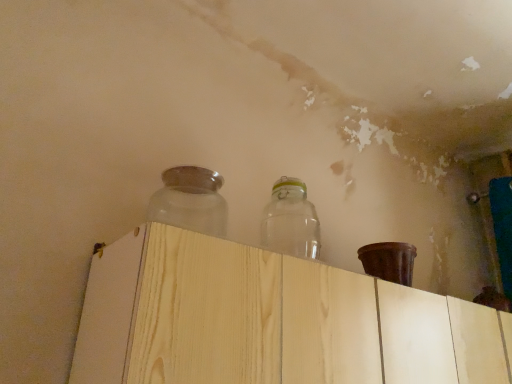
Question: Can you confirm if light wood dresser at center is thinner than frosted glass jar at upper center, the 1th bottle viewed from the left?

Choices:
 (A) yes
 (B) no

Answer: (B)

Question: Is light wood dresser at center to the left of frosted glass jar at upper center, the 1th bottle viewed from the left, from the viewer's perspective?

Choices:
 (A) no
 (B) yes

Answer: (A)

Question: Is frosted glass jar at upper center, the 1th bottle viewed from the left, surrounded by light wood dresser at center?

Choices:
 (A) yes
 (B) no

Answer: (B)

Question: Could you tell me if light wood dresser at center is facing frosted glass jar at upper center, positioned as the second bottle in right-to-left order?

Choices:
 (A) yes
 (B) no

Answer: (B)

Question: Is light wood dresser at center at the right side of frosted glass jar at upper center, the 1th bottle viewed from the left?

Choices:
 (A) no
 (B) yes

Answer: (B)

Question: From the image's perspective, is light wood dresser at center above or below frosted glass jar at upper center, the 1th bottle viewed from the left?

Choices:
 (A) below
 (B) above

Answer: (A)

Question: In the image, is light wood dresser at center on the left side or the right side of frosted glass jar at upper center, positioned as the second bottle in right-to-left order?

Choices:
 (A) right
 (B) left

Answer: (A)

Question: Based on their sizes in the image, would you say light wood dresser at center is bigger or smaller than frosted glass jar at upper center, positioned as the second bottle in right-to-left order?

Choices:
 (A) small
 (B) big

Answer: (B)

Question: In terms of height, does light wood dresser at center look taller or shorter compared to frosted glass jar at upper center, the 1th bottle viewed from the left?

Choices:
 (A) tall
 (B) short

Answer: (A)

Question: Considering their positions, is light wood dresser at center located in front of or behind transparent glass jar at upper center, arranged as the first bottle when viewed from the right?

Choices:
 (A) front
 (B) behind

Answer: (A)

Question: From a real-world perspective, relative to transparent glass jar at upper center, the 2th bottle when ordered from left to right, is light wood dresser at center vertically above or below?

Choices:
 (A) above
 (B) below

Answer: (B)

Question: Considering the positions of point click(91, 360) and point click(312, 220), is point click(91, 360) closer or farther from the camera than point click(312, 220)?

Choices:
 (A) farther
 (B) closer

Answer: (B)

Question: In the image, is light wood dresser at center on the left side or the right side of transparent glass jar at upper center, arranged as the first bottle when viewed from the right?

Choices:
 (A) right
 (B) left

Answer: (A)

Question: From their relative heights in the image, would you say frosted glass jar at upper center, the 1th bottle viewed from the left, is taller or shorter than transparent glass jar at upper center, the 2th bottle when ordered from left to right?

Choices:
 (A) tall
 (B) short

Answer: (B)

Question: Would you say frosted glass jar at upper center, positioned as the second bottle in right-to-left order, is to the left or to the right of transparent glass jar at upper center, the 2th bottle when ordered from left to right, in the picture?

Choices:
 (A) right
 (B) left

Answer: (B)